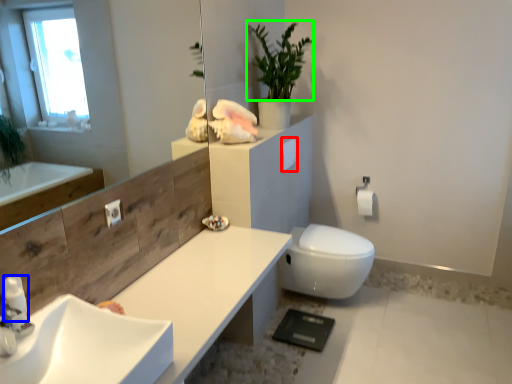
Question: Based on their relative distances, which object is farther from toilet paper (highlighted by a red box)? Choose from soap dispenser (highlighted by a blue box) and plant (highlighted by a green box).

Choices:
 (A) soap dispenser
 (B) plant

Answer: (A)